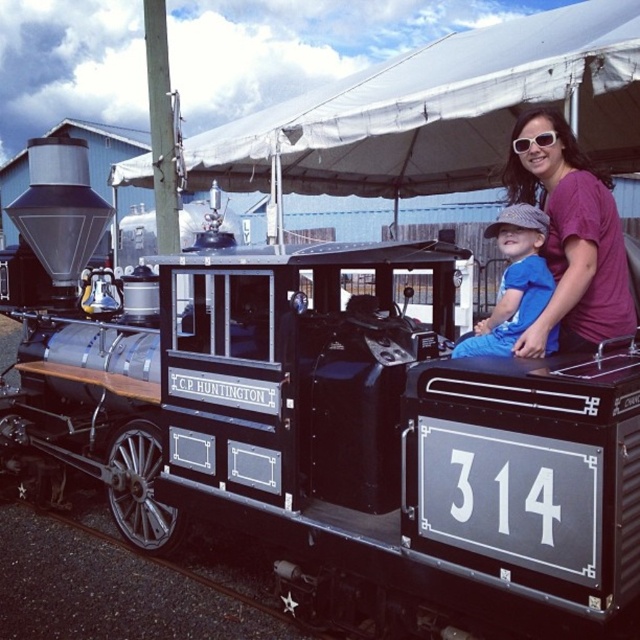
You are a photographer standing in front of the C.P. HUNTINGTON locomotive. You notice the white fabric canopy at upper center and the purple cotton shirt at upper right in your viewfinder. Which object is located to the left of the other?

The white fabric canopy at upper center is positioned on the left side of purple cotton shirt at upper right.